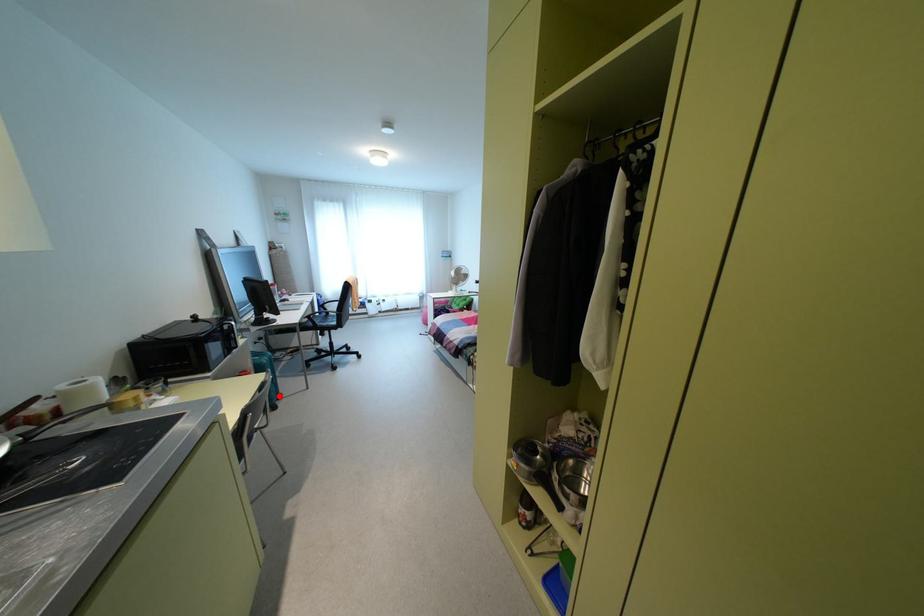
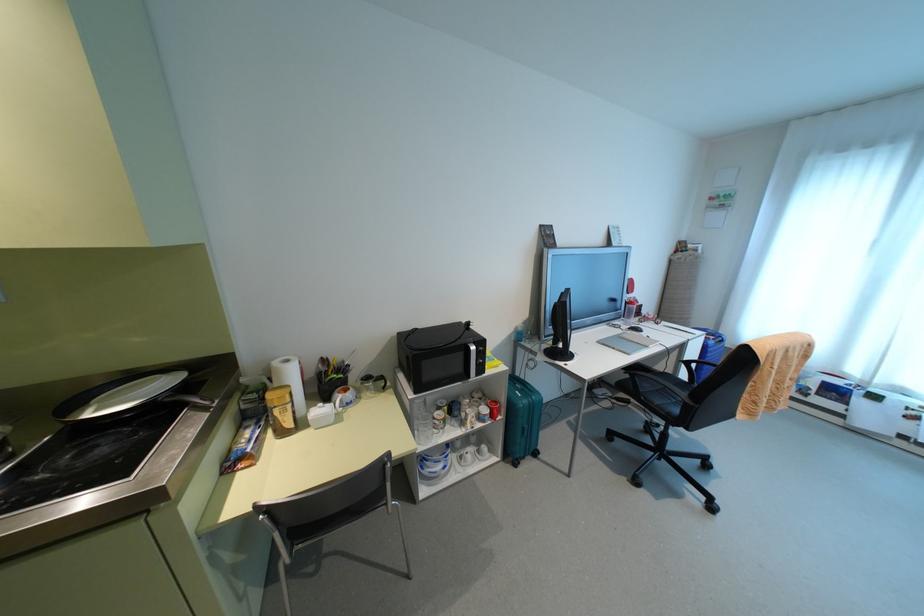
Question: A red point is marked in image1. In image2, is the corresponding 3D point closer to the camera or farther? Reply with the corresponding letter.

Choices:
 (A) The corresponding 3D point is closer.
 (B) The corresponding 3D point is farther.

Answer: (B)